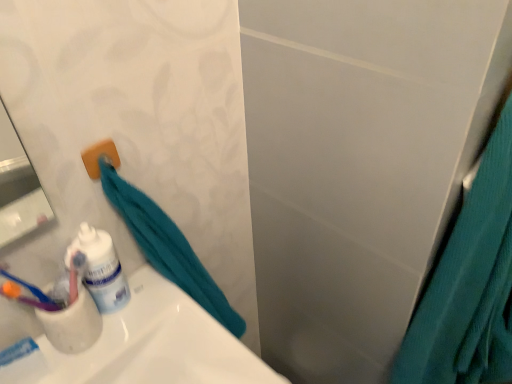
In order to click on teal fabric shower curtain at right in this screenshot , I will do `click(469, 285)`.

Identify the location of white matte toothpaste at lower left. This screenshot has width=512, height=384. (18, 351).

Image resolution: width=512 pixels, height=384 pixels. In order to click on teal fabric shower curtain at right in this screenshot , I will do [469, 285].

Is teal fabric shower curtain at right shorter than white glossy toothpaste tube at lower left?

No.

Is teal fabric shower curtain at right aimed at white glossy toothpaste tube at lower left?

No, teal fabric shower curtain at right is not aimed at white glossy toothpaste tube at lower left.

Between teal fabric shower curtain at right and white glossy toothpaste tube at lower left, which one appears on the left side from the viewer's perspective?

Positioned to the left is white glossy toothpaste tube at lower left.

Considering the relative sizes of teal fabric shower curtain at right and white glossy toothpaste tube at lower left in the image provided, is teal fabric shower curtain at right thinner than white glossy toothpaste tube at lower left?

No, teal fabric shower curtain at right is not thinner than white glossy toothpaste tube at lower left.

From the image's perspective, is teal fabric towel at left on top of white glossy toothpaste tube at lower left?

No, from the image's perspective, teal fabric towel at left is not on top of white glossy toothpaste tube at lower left.

Is point (153, 228) closer to camera compared to point (81, 246)?

No, it is behind (81, 246).

Does teal fabric towel at left have a smaller size compared to white glossy toothpaste tube at lower left?

Incorrect, teal fabric towel at left is not smaller in size than white glossy toothpaste tube at lower left.

Is teal fabric towel at left not near white glossy toothpaste tube at lower left?

Actually, teal fabric towel at left and white glossy toothpaste tube at lower left are a little close together.

From the image's perspective, which is above, white matte toothpaste at lower left or teal fabric towel at left?

teal fabric towel at left is shown above in the image.

How many degrees apart are the facing directions of white matte toothpaste at lower left and teal fabric towel at left?

white matte toothpaste at lower left and teal fabric towel at left are facing 3.92 degrees away from each other.

From a real-world perspective, is white matte toothpaste at lower left located beneath teal fabric towel at left?

No, from a real-world perspective, white matte toothpaste at lower left is not under teal fabric towel at left.

Find the location of a particular element. The height and width of the screenshot is (384, 512). bath towel lying on the right of white matte toothpaste at lower left is located at coordinates (167, 247).

Who is smaller, white matte toothpaste at lower left or white glossy toothpaste tube at lower left?

Smaller between the two is white matte toothpaste at lower left.

Between white matte toothpaste at lower left and white glossy toothpaste tube at lower left, which one has more height?

With more height is white glossy toothpaste tube at lower left.

Can you confirm if white matte toothpaste at lower left is positioned to the left of white glossy toothpaste tube at lower left?

Correct, you'll find white matte toothpaste at lower left to the left of white glossy toothpaste tube at lower left.

In the image, is white matte toothpaste at lower left positioned in front of or behind white glossy toothpaste tube at lower left?

white matte toothpaste at lower left is positioned farther from the viewer than white glossy toothpaste tube at lower left.

In terms of width, does teal fabric shower curtain at right look wider or thinner when compared to white matte toothpaste at lower left?

Considering their sizes, teal fabric shower curtain at right looks broader than white matte toothpaste at lower left.

Are teal fabric shower curtain at right and white matte toothpaste at lower left beside each other?

No, teal fabric shower curtain at right is not next to white matte toothpaste at lower left.

Could white matte toothpaste at lower left be considered to be inside teal fabric shower curtain at right?

Actually, white matte toothpaste at lower left is outside teal fabric shower curtain at right.

Which point is more forward, (452,284) or (5,352)?

The point (5,352) is more forward.

Where is `toiletry above the teal fabric towel at left (from the image's perspective)`? toiletry above the teal fabric towel at left (from the image's perspective) is located at coordinates (100, 268).

Considering the relative sizes of white glossy toothpaste tube at lower left and teal fabric towel at left in the image provided, is white glossy toothpaste tube at lower left thinner than teal fabric towel at left?

Yes.

Is white glossy toothpaste tube at lower left aimed at teal fabric towel at left?

No, white glossy toothpaste tube at lower left is not oriented towards teal fabric towel at left.

How many degrees apart are the facing directions of teal fabric towel at left and teal fabric shower curtain at right?

teal fabric towel at left and teal fabric shower curtain at right are facing 0.175 degrees away from each other.

How much distance is there between teal fabric towel at left and teal fabric shower curtain at right?

teal fabric towel at left and teal fabric shower curtain at right are 17.80 inches apart from each other.

In the image, is teal fabric towel at left positioned in front of or behind teal fabric shower curtain at right?

In the image, teal fabric towel at left appears behind teal fabric shower curtain at right.

Is teal fabric towel at left facing towards teal fabric shower curtain at right?

No, teal fabric towel at left does not turn towards teal fabric shower curtain at right.

Where is `toiletry lying behind the teal fabric shower curtain at right`? toiletry lying behind the teal fabric shower curtain at right is located at coordinates (100, 268).

Locate an element on the screen. This screenshot has height=384, width=512. bath towel below the white glossy toothpaste tube at lower left (from the image's perspective) is located at coordinates (167, 247).

When comparing their distances from teal fabric shower curtain at right, does white matte toothpaste at lower left or white glossy toothpaste tube at lower left seem further?

white matte toothpaste at lower left.

From the image, which object appears to be farther from white matte toothpaste at lower left, teal fabric towel at left or white glossy toothpaste tube at lower left?

teal fabric towel at left lies further to white matte toothpaste at lower left than the other object.

Considering their positions, is white matte toothpaste at lower left positioned closer to teal fabric shower curtain at right than teal fabric towel at left?

teal fabric towel at left is closer to teal fabric shower curtain at right.

When comparing their distances from white glossy toothpaste tube at lower left, does teal fabric towel at left or white matte toothpaste at lower left seem further?

white matte toothpaste at lower left is further to white glossy toothpaste tube at lower left.

Considering their positions, is teal fabric shower curtain at right positioned further to white matte toothpaste at lower left than teal fabric towel at left?

teal fabric shower curtain at right is further to white matte toothpaste at lower left.

Which object lies nearer to the anchor point teal fabric shower curtain at right, white glossy toothpaste tube at lower left or teal fabric towel at left?

Among the two, teal fabric towel at left is located nearer to teal fabric shower curtain at right.

Considering their positions, is white glossy toothpaste tube at lower left positioned closer to teal fabric towel at left than white matte toothpaste at lower left?

The object closer to teal fabric towel at left is white glossy toothpaste tube at lower left.

Which object lies nearer to the anchor point white matte toothpaste at lower left, teal fabric towel at left or teal fabric shower curtain at right?

teal fabric towel at left is positioned closer to the anchor white matte toothpaste at lower left.

This screenshot has width=512, height=384. I want to click on toiletry between white matte toothpaste at lower left and teal fabric towel at left from left to right, so click(x=100, y=268).

This screenshot has height=384, width=512. Identify the location of toiletry located between white matte toothpaste at lower left and teal fabric shower curtain at right in the left-right direction. (100, 268).

Where is `bath towel between white matte toothpaste at lower left and teal fabric shower curtain at right from left to right`? The image size is (512, 384). bath towel between white matte toothpaste at lower left and teal fabric shower curtain at right from left to right is located at coordinates (167, 247).

Locate an element on the screen. This screenshot has width=512, height=384. bath towel between white glossy toothpaste tube at lower left and teal fabric shower curtain at right in the horizontal direction is located at coordinates (167, 247).